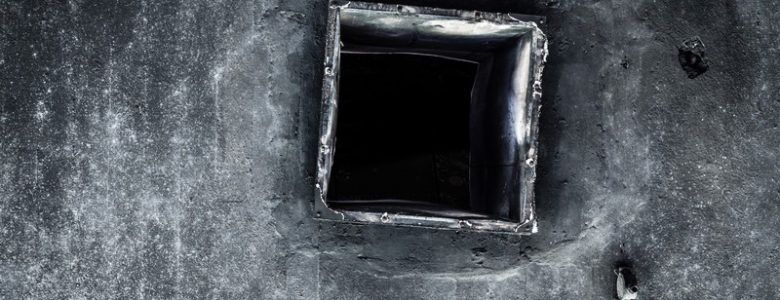
You are a GUI agent. You are given a task and a screenshot of the screen. Output one action in this format:
    pyautogui.click(x=<x>, y=<y>)
    Task: Click on the window
    This screenshot has width=780, height=300.
    Given the screenshot: What is the action you would take?
    pyautogui.click(x=417, y=142)